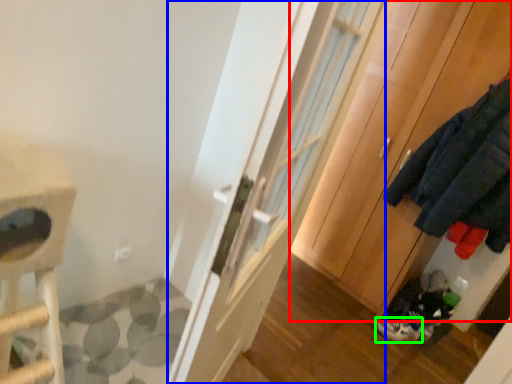
Question: Which object is positioned closest to cabinetry (highlighted by a red box)? Select from door (highlighted by a blue box) and footwear (highlighted by a green box).

Choices:
 (A) door
 (B) footwear

Answer: (B)